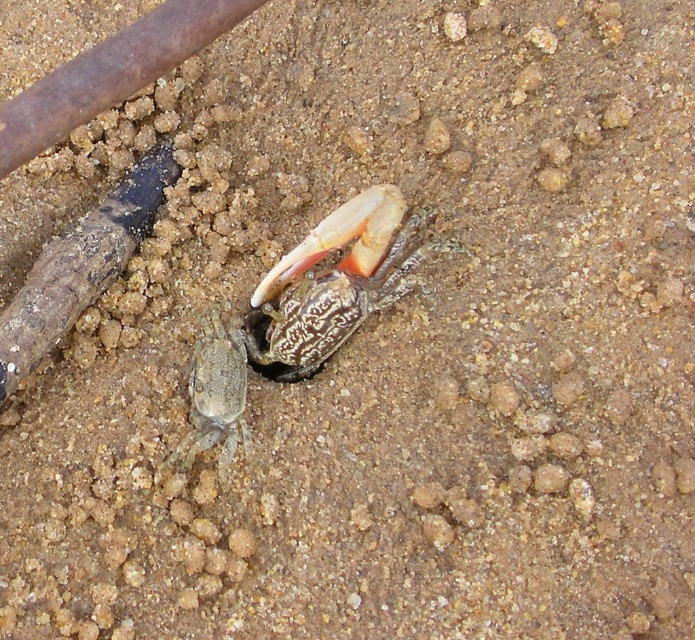
Consider the image. Does shiny metallic crab at center have a smaller size compared to gray matte crab at lower left?

No.

Between point (359, 288) and point (213, 352), which one is positioned in front?

Point (359, 288)

The height and width of the screenshot is (640, 695). What do you see at coordinates (336, 282) in the screenshot?
I see `shiny metallic crab at center` at bounding box center [336, 282].

Image resolution: width=695 pixels, height=640 pixels. I want to click on shiny metallic crab at center, so click(336, 282).